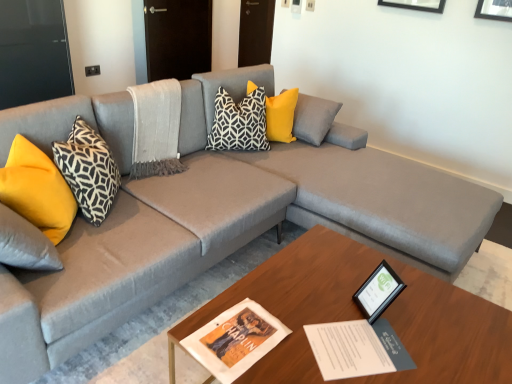
The height and width of the screenshot is (384, 512). I want to click on free location in front of black glossy picture frame at lower right, so click(381, 345).